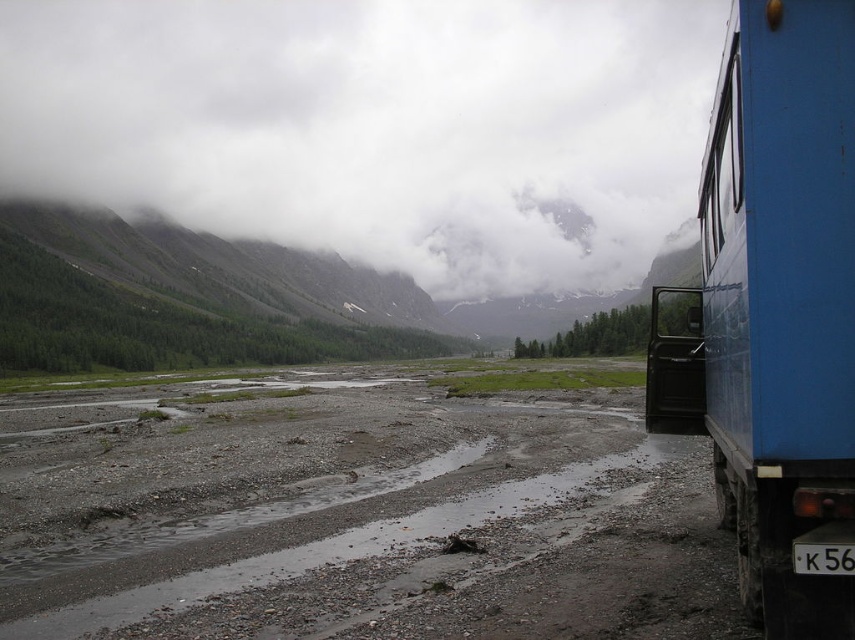
Is damp gravel dirt track at center to the right of cloudy fog at upper center from the viewer's perspective?

Indeed, damp gravel dirt track at center is positioned on the right side of cloudy fog at upper center.

From the picture: Does damp gravel dirt track at center appear on the left side of cloudy fog at upper center?

Incorrect, damp gravel dirt track at center is not on the left side of cloudy fog at upper center.

Find the location of a particular element. The height and width of the screenshot is (640, 855). damp gravel dirt track at center is located at coordinates (355, 509).

At what (x,y) coordinates should I click in order to perform the action: click on damp gravel dirt track at center. Please return your answer as a coordinate pair (x, y). Looking at the image, I should click on (355, 509).

Does blue metallic truck at right appear over black plastic license plate at lower right?

Correct, blue metallic truck at right is located above black plastic license plate at lower right.

How far apart are blue metallic truck at right and black plastic license plate at lower right?

blue metallic truck at right and black plastic license plate at lower right are 2.17 meters apart from each other.

Is point (771, 186) in front of point (818, 544)?

No, (771, 186) is behind (818, 544).

Where is `blue metallic truck at right`? The width and height of the screenshot is (855, 640). blue metallic truck at right is located at coordinates (774, 308).

Which of these two, cloudy fog at upper center or black plastic license plate at lower right, stands shorter?

black plastic license plate at lower right is shorter.

Is cloudy fog at upper center smaller than black plastic license plate at lower right?

No, cloudy fog at upper center is not smaller than black plastic license plate at lower right.

Does point (575, 3) lie behind point (818, 564)?

Yes.

Find the location of `cloudy fog at upper center`. cloudy fog at upper center is located at coordinates (375, 125).